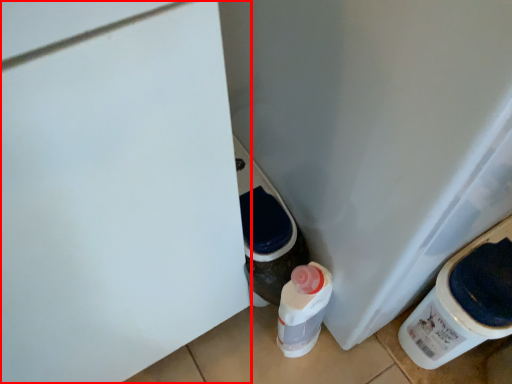
Question: From the image's perspective, considering the relative positions of door (annotated by the red box) and water cooler in the image provided, where is door (annotated by the red box) located with respect to the staircase?

Choices:
 (A) above
 (B) below

Answer: (B)